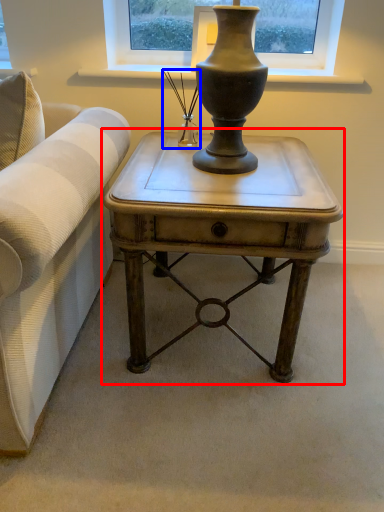
Question: Among these objects, which one is nearest to the camera, table (highlighted by a red box) or candle holder (highlighted by a blue box)?

Choices:
 (A) table
 (B) candle holder

Answer: (A)